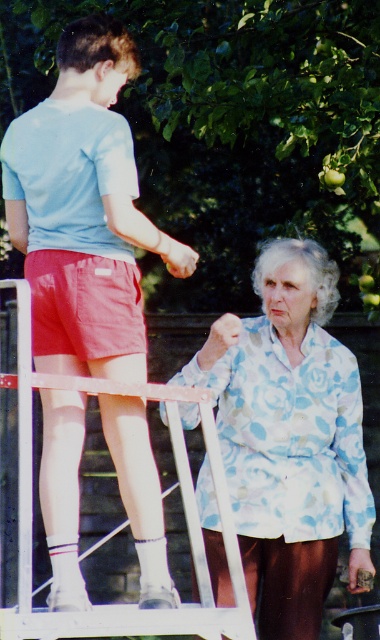
Which is above, matte blue t-shirt at upper left or floral-patterned shirt at lower right?

matte blue t-shirt at upper left is above.

Can you confirm if matte blue t-shirt at upper left is wider than floral-patterned shirt at lower right?

No.

Between point (71, 51) and point (213, 499), which one is positioned in front?

Point (71, 51)

Where is `matte blue t-shirt at upper left`? matte blue t-shirt at upper left is located at coordinates (83, 211).

Is matte blue t-shirt at upper left thinner than matte red shorts at left?

No.

Is matte blue t-shirt at upper left smaller than matte red shorts at left?

Actually, matte blue t-shirt at upper left might be larger than matte red shorts at left.

Describe the element at coordinates (83, 211) in the screenshot. I see `matte blue t-shirt at upper left` at that location.

Find the location of a particular element. matte blue t-shirt at upper left is located at coordinates (83, 211).

Is point (286, 259) closer to camera compared to point (114, 292)?

No, it is behind (114, 292).

Is floral-patterned shirt at lower right bigger than matte red shorts at left?

Correct, floral-patterned shirt at lower right is larger in size than matte red shorts at left.

Which is behind, point (223, 362) or point (126, 288)?

Point (223, 362)

Locate an element on the screen. This screenshot has width=380, height=640. floral-patterned shirt at lower right is located at coordinates (289, 436).